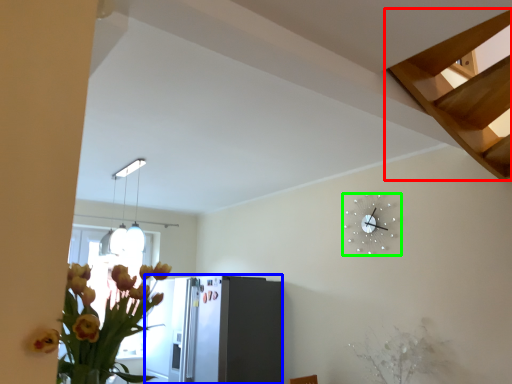
Question: Which is nearer to the stairs (highlighted by a red box)? appliance (highlighted by a blue box) or wall clock (highlighted by a green box).

Choices:
 (A) appliance
 (B) wall clock

Answer: (B)